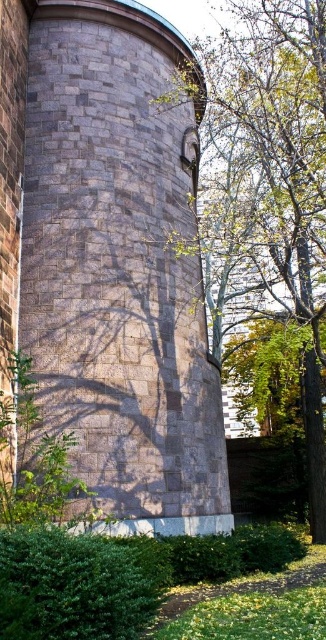
You are standing in front of a gray stone tower at center. There is a point marked at coordinates (108, 259). Based on the description, can you determine if this point is located on the gray stone tower at center?

Yes, the point (108, 259) is located on the gray stone tower at center as stated in the description.

You are standing in front of the gray stone tower at center and the green leafy tree at center. Which object is nearer to you?

The gray stone tower at center is closer to the viewer than the green leafy tree at center.

You are standing at the point marked as point (19, 125) in the image of a cylindrical stone structure. You want to take a photo of the entire structure. Considering the distance between you and the camera, is it possible to capture the entire structure in one shot without moving?

The distance between point (19, 125) and the camera is 83.38 feet. However, since the structure is cylindrical, standing at this point might not allow capturing the entire structure in one shot without moving, as the curvature could require a wider angle or repositioning to include all parts.